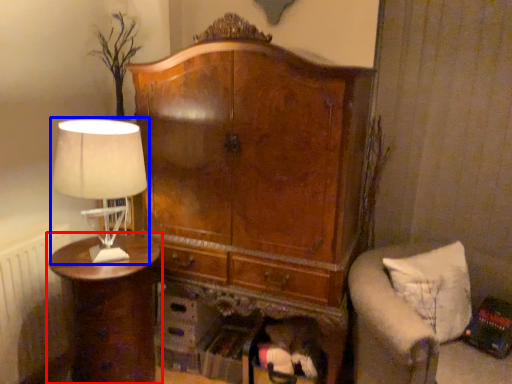
Question: Among these objects, which one is farthest to the camera, nightstand (highlighted by a red box) or lamp (highlighted by a blue box)?

Choices:
 (A) nightstand
 (B) lamp

Answer: (A)